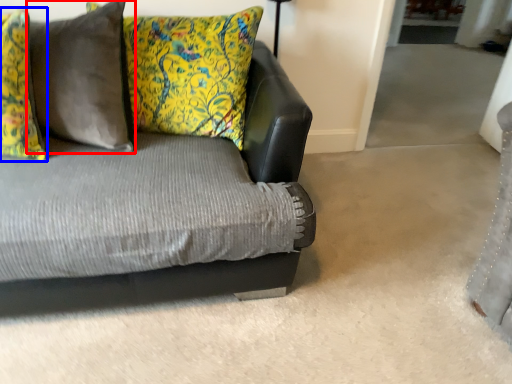
Question: Which of the following is the farthest to the observer, pillow (highlighted by a red box) or pillow (highlighted by a blue box)?

Choices:
 (A) pillow
 (B) pillow

Answer: (A)